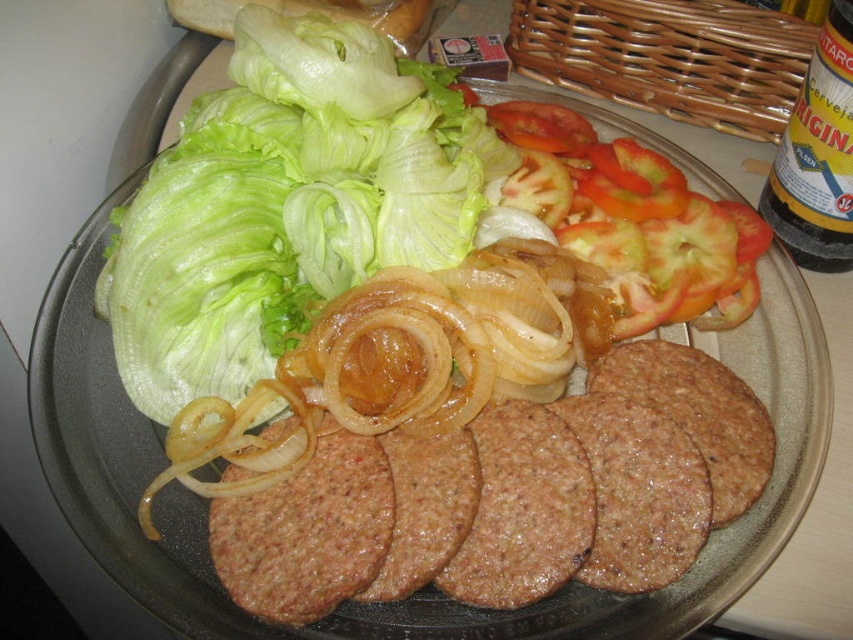
Question: Is green leafy lettuce at upper left smaller than yellow glass bottle at upper right?

Choices:
 (A) yes
 (B) no

Answer: (B)

Question: Which is farther from the sliced red tomato at upper right?

Choices:
 (A) green leafy lettuce at upper left
 (B) brown textured meat at center

Answer: (A)

Question: Does brown textured meat at center have a larger size compared to yellow glass bottle at upper right?

Choices:
 (A) no
 (B) yes

Answer: (B)

Question: Which is farther from the sliced red tomato at upper right?

Choices:
 (A) yellow glass bottle at upper right
 (B) brown textured meat at center

Answer: (B)

Question: Can you confirm if green leafy lettuce at upper left is positioned to the right of brown textured meat at center?

Choices:
 (A) no
 (B) yes

Answer: (A)

Question: Which point is farther to the camera?

Choices:
 (A) green leafy lettuce at upper left
 (B) brown textured meat at center
 (C) yellow glass bottle at upper right
 (D) sliced red tomato at upper right

Answer: (D)